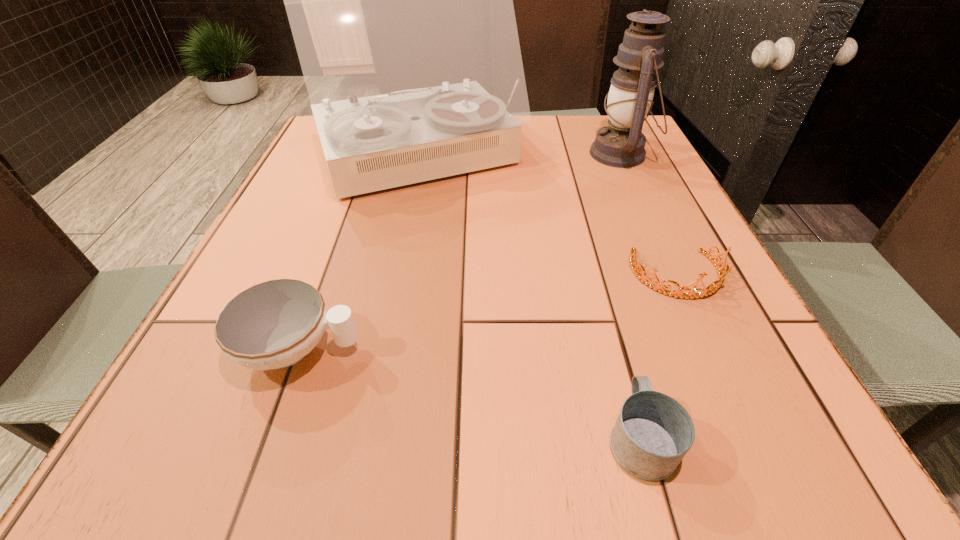
Where is `free spot that satisfies the following two spatial constraints: 1. on the side of the oil lamp with the handle; 2. on the left side of the nearest object`? free spot that satisfies the following two spatial constraints: 1. on the side of the oil lamp with the handle; 2. on the left side of the nearest object is located at coordinates (564, 154).